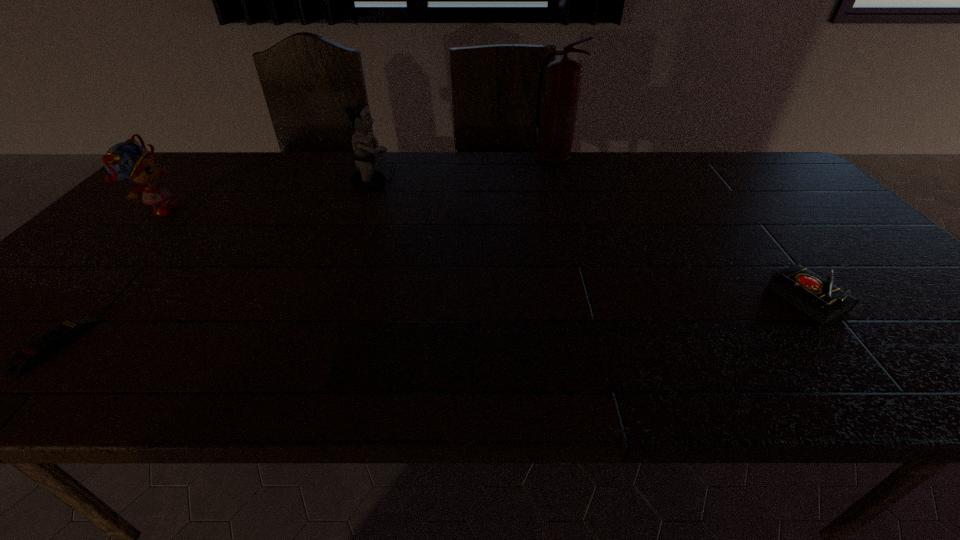
Image resolution: width=960 pixels, height=540 pixels. I want to click on vacant region that satisfies the following two spatial constraints: 1. on the front-facing side of the fourth tallest object; 2. on the right side of the third object from left to right, so click(329, 299).

This screenshot has width=960, height=540. Identify the location of free spot that satisfies the following two spatial constraints: 1. on the front-facing side of the figurine; 2. on the left side of the diary. (329, 299).

Locate an element on the screen. free space that satisfies the following two spatial constraints: 1. on the front-facing side of the diary; 2. on the left side of the third object from left to right is located at coordinates (329, 299).